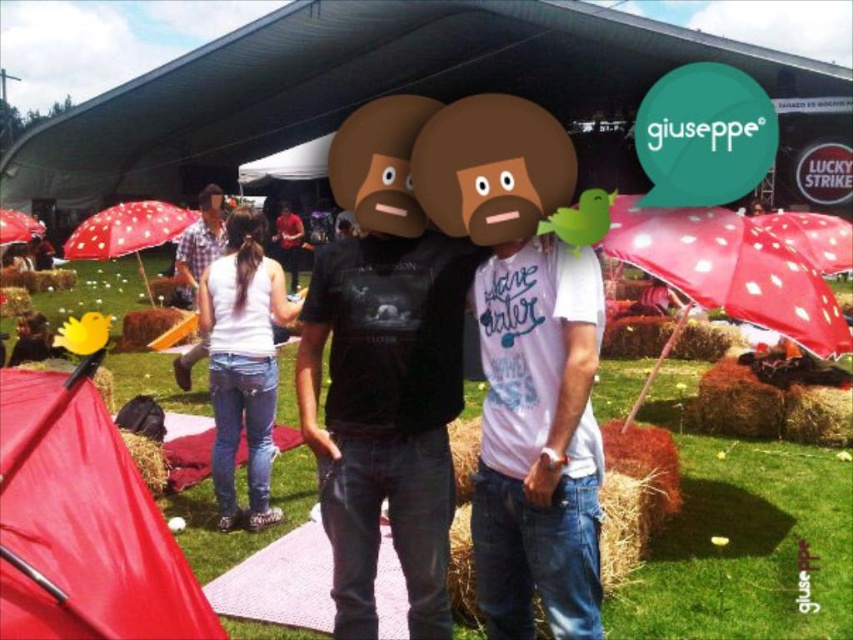
Question: Based on their relative distances, which object is farther from the red dotted umbrella at lower left?

Choices:
 (A) checkered fabric shirt at center
 (B) red fabric canopy at lower left
 (C) red shirt at center
 (D) red polka dot fabric umbrella at right

Answer: (D)

Question: Is red fabric canopy at lower left above red polka dot umbrella at upper center?

Choices:
 (A) yes
 (B) no

Answer: (B)

Question: Does white denim jeans at lower left lie behind red polka dot umbrella at upper center?

Choices:
 (A) no
 (B) yes

Answer: (A)

Question: Which point is farther to the camera?

Choices:
 (A) red dotted umbrella at lower left
 (B) red polka dot fabric umbrella at right
 (C) red matte umbrella at left

Answer: (C)

Question: Which point is closer to the camera?

Choices:
 (A) (289, 282)
 (B) (109, 236)

Answer: (B)

Question: Is red dotted umbrella at lower left in front of red polka dot umbrella at upper center?

Choices:
 (A) yes
 (B) no

Answer: (B)